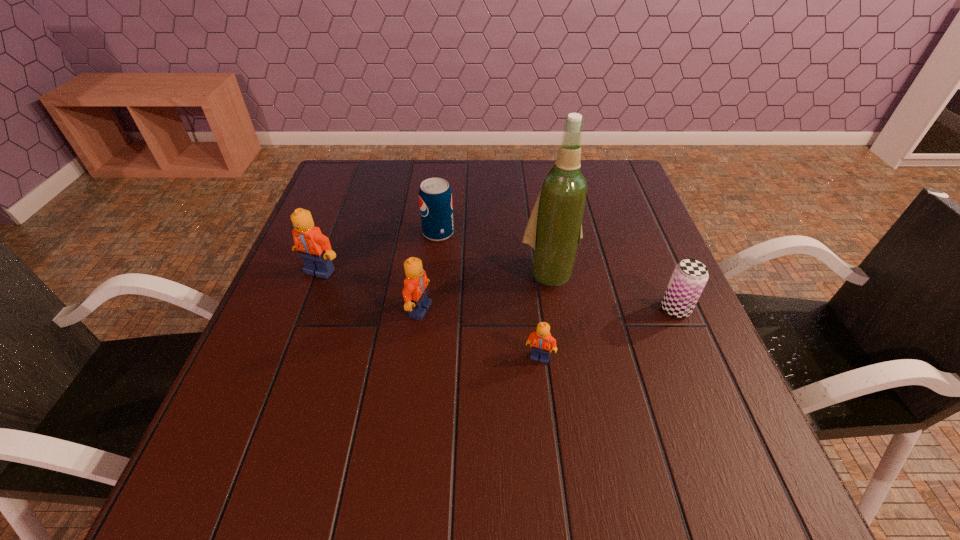
This screenshot has width=960, height=540. Find the location of `the leftmost object`. the leftmost object is located at coordinates (314, 248).

You are a GUI agent. You are given a task and a screenshot of the screen. Output one action in this format:
    pyautogui.click(x=<x>, y=<y>)
    Task: Click on the farthest Lego
    This screenshot has height=540, width=960.
    Given the screenshot: What is the action you would take?
    pyautogui.click(x=314, y=248)

Locate an element on the screen. This screenshot has height=540, width=960. the second shortest Lego is located at coordinates (415, 289).

What are the coordinates of `the second Lego from left to right` in the screenshot? It's located at (415, 289).

Find the location of `the shortest Lego`. the shortest Lego is located at coordinates (541, 341).

Where is `the nearest Lego`? the nearest Lego is located at coordinates (541, 341).

Find the location of `the second shortest object`. the second shortest object is located at coordinates (690, 276).

The width and height of the screenshot is (960, 540). Find the location of `the rightmost object`. the rightmost object is located at coordinates 690,276.

Find the location of a particular element. pop is located at coordinates (435, 198).

Locate an element on the screen. The image size is (960, 540). wine bottle is located at coordinates (554, 229).